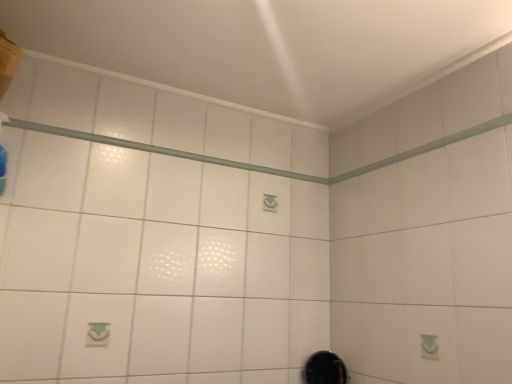
This screenshot has width=512, height=384. What do you see at coordinates (324, 369) in the screenshot?
I see `black glossy mirror at lower right` at bounding box center [324, 369].

At what (x,y) coordinates should I click in order to perform the action: click on black glossy mirror at lower right. Please return your answer as a coordinate pair (x, y). Looking at the image, I should click on (324, 369).

In the scene shown: Measure the distance between black glossy mirror at lower right and camera.

black glossy mirror at lower right and camera are 1.60 meters apart.

Measure the distance between point (x=321, y=364) and camera.

Point (x=321, y=364) and camera are 1.65 meters apart.

The width and height of the screenshot is (512, 384). What do you see at coordinates (158, 150) in the screenshot?
I see `white glossy shower at upper center` at bounding box center [158, 150].

Image resolution: width=512 pixels, height=384 pixels. I want to click on white glossy shower at upper center, so click(158, 150).

Measure the distance between white glossy shower at upper center and camera.

A distance of 4.41 feet exists between white glossy shower at upper center and camera.

You are a GUI agent. You are given a task and a screenshot of the screen. Output one action in this format:
    pyautogui.click(x=<x>, y=<y>)
    Task: Click on the black glossy mirror at lower right
    
    Given the screenshot: What is the action you would take?
    pyautogui.click(x=324, y=369)

Between white glossy shower at upper center and black glossy mirror at lower right, which one appears on the left side from the viewer's perspective?

white glossy shower at upper center.

Is white glossy shower at upper center in front of or behind black glossy mirror at lower right in the image?

→ Visually, white glossy shower at upper center is located in front of black glossy mirror at lower right.

Which is behind, point (164, 149) or point (327, 372)?

The point (327, 372) is farther from the camera.

From the image's perspective, who appears lower, white glossy shower at upper center or black glossy mirror at lower right?

From the image's view, black glossy mirror at lower right is below.

Looking at this image, from a real-world perspective, is white glossy shower at upper center above or below black glossy mirror at lower right?

white glossy shower at upper center is situated higher than black glossy mirror at lower right in the real world.

Considering the sizes of objects white glossy shower at upper center and black glossy mirror at lower right in the image provided, who is wider, white glossy shower at upper center or black glossy mirror at lower right?

black glossy mirror at lower right is wider.

Is white glossy shower at upper center taller than black glossy mirror at lower right?

No, white glossy shower at upper center is not taller than black glossy mirror at lower right.

Considering the sizes of objects white glossy shower at upper center and black glossy mirror at lower right in the image provided, who is smaller, white glossy shower at upper center or black glossy mirror at lower right?

white glossy shower at upper center.

From the picture: Could black glossy mirror at lower right be considered to be inside white glossy shower at upper center?

No, black glossy mirror at lower right is located outside of white glossy shower at upper center.

Is white glossy shower at upper center next to black glossy mirror at lower right and touching it?

white glossy shower at upper center is not next to black glossy mirror at lower right, and they're not touching.

Is white glossy shower at upper center oriented away from black glossy mirror at lower right?

That's not correct — white glossy shower at upper center is not looking away from black glossy mirror at lower right.

How different are the orientations of white glossy shower at upper center and black glossy mirror at lower right in degrees?

The facing directions of white glossy shower at upper center and black glossy mirror at lower right are 90.5 degrees apart.

The width and height of the screenshot is (512, 384). Identify the location of mirror behind the white glossy shower at upper center. (324, 369).

Between black glossy mirror at lower right and white glossy shower at upper center, which one appears on the right side from the viewer's perspective?

Positioned to the right is black glossy mirror at lower right.

Is the position of black glossy mirror at lower right more distant than that of white glossy shower at upper center?

Yes.

Is point (335, 383) farther from viewer compared to point (143, 150)?

Yes, point (335, 383) is farther from viewer.

From the image's perspective, is black glossy mirror at lower right on white glossy shower at upper center?

Incorrect, from the image's perspective, black glossy mirror at lower right is lower than white glossy shower at upper center.

From a real-world perspective, which is physically below, black glossy mirror at lower right or white glossy shower at upper center?

In real-world perspective, black glossy mirror at lower right is lower.

In the scene shown: Considering the sizes of black glossy mirror at lower right and white glossy shower at upper center in the image, is black glossy mirror at lower right wider or thinner than white glossy shower at upper center?

Clearly, black glossy mirror at lower right has more width compared to white glossy shower at upper center.

Looking at this image, considering the relative sizes of black glossy mirror at lower right and white glossy shower at upper center in the image provided, is black glossy mirror at lower right shorter than white glossy shower at upper center?

In fact, black glossy mirror at lower right may be taller than white glossy shower at upper center.

Looking at the image, does black glossy mirror at lower right seem bigger or smaller compared to white glossy shower at upper center?

In the image, black glossy mirror at lower right appears to be larger than white glossy shower at upper center.

Is black glossy mirror at lower right inside the boundaries of white glossy shower at upper center, or outside?

black glossy mirror at lower right is not inside white glossy shower at upper center, it's outside.

Are black glossy mirror at lower right and white glossy shower at upper center making contact?

No, black glossy mirror at lower right is not in contact with white glossy shower at upper center.

Is black glossy mirror at lower right looking in the opposite direction of white glossy shower at upper center?

black glossy mirror at lower right does not have its back to white glossy shower at upper center.

How many degrees apart are the facing directions of black glossy mirror at lower right and white glossy shower at upper center?

There is a 90.5-degree angle between the facing directions of black glossy mirror at lower right and white glossy shower at upper center.

How far apart are black glossy mirror at lower right and white glossy shower at upper center?

A distance of 33.70 inches exists between black glossy mirror at lower right and white glossy shower at upper center.

The height and width of the screenshot is (384, 512). I want to click on mirror located below the white glossy shower at upper center (from the image's perspective), so click(x=324, y=369).

In the image, there is a white glossy shower at upper center. What are the coordinates of `mirror below it (from a real-world perspective)` in the screenshot? It's located at point(324,369).

This screenshot has height=384, width=512. In order to click on shower that is above the black glossy mirror at lower right (from a real-world perspective) in this screenshot , I will do `click(158, 150)`.